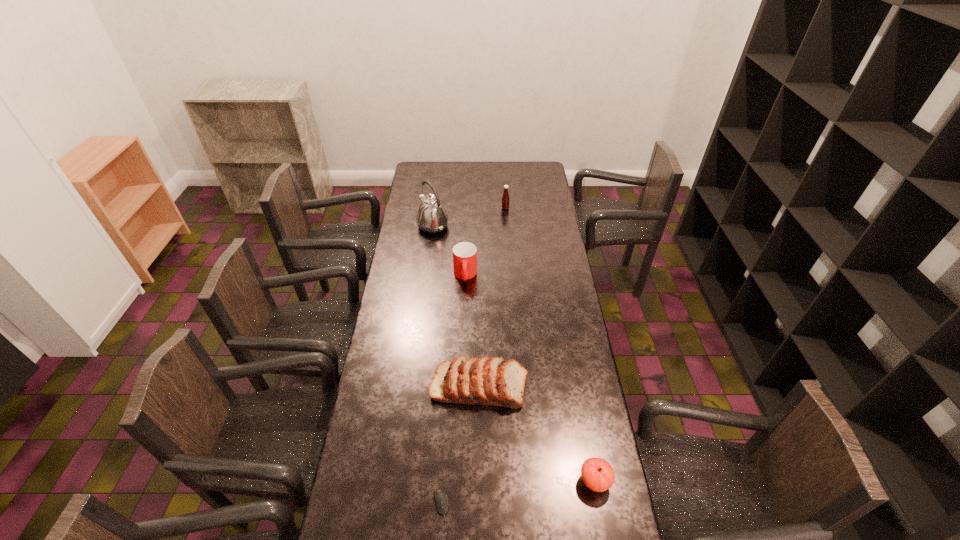
This screenshot has height=540, width=960. In order to click on blank area located 0.090m on the right of the bread in this screenshot , I will do `click(554, 387)`.

This screenshot has width=960, height=540. Find the location of `free region located on the left of the rightmost object`. free region located on the left of the rightmost object is located at coordinates (544, 482).

Identify the location of free spot located on the back of the shortest object. (448, 393).

The image size is (960, 540). In order to click on object present at the left edge in this screenshot , I will do `click(432, 217)`.

Identify the location of object that is at the right edge. (597, 474).

The width and height of the screenshot is (960, 540). I want to click on vacant area at the far edge of the desktop, so 517,170.

This screenshot has width=960, height=540. Identify the location of vacant region at the left edge of the desktop. (396, 302).

The width and height of the screenshot is (960, 540). I want to click on vacant space at the right edge of the desktop, so click(594, 497).

Locate an element on the screen. Image resolution: width=960 pixels, height=540 pixels. vacant area between the bread and the farthest object is located at coordinates (492, 298).

This screenshot has width=960, height=540. In order to click on vacant region between the rightmost object and the farthest object in this screenshot , I will do `click(550, 345)`.